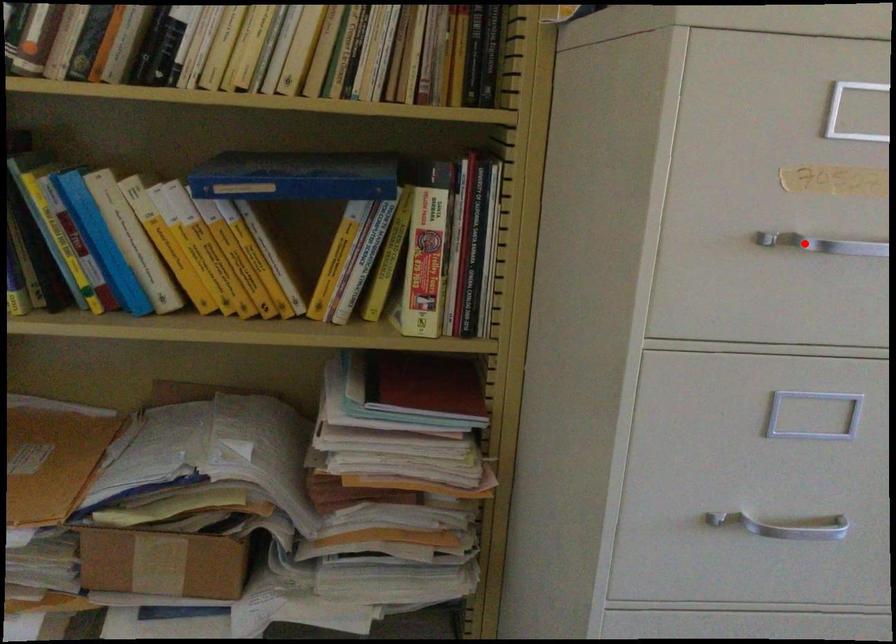
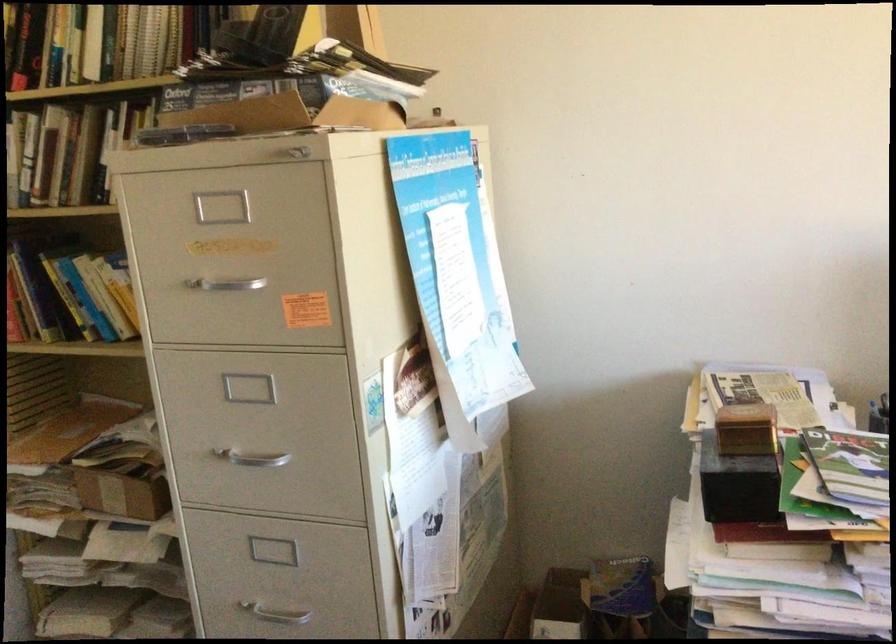
Question: I am providing you with two images of the same scene from different viewpoints. In image1, a red point is highlighted. Considering the same 3D point in image2, which of the following is correct?

Choices:
 (A) It is closer
 (B) It is farther

Answer: (B)